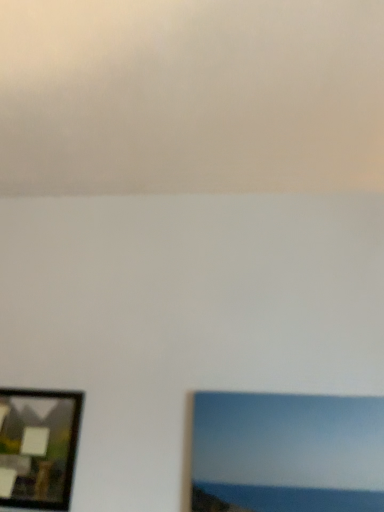
In order to face matte blue picture frame at lower right, the 1th picture frame viewed from the right, should I rotate leftwards or rightwards?

Turn right by 12.004 degrees to look at matte blue picture frame at lower right, the 1th picture frame viewed from the right.

This screenshot has height=512, width=384. Identify the location of matte blue picture frame at lower right, positioned as the second picture frame in left-to-right order. (287, 453).

What is the approximate height of matte blue picture frame at lower right, the 1th picture frame viewed from the right?

matte blue picture frame at lower right, the 1th picture frame viewed from the right, is 33.88 centimeters tall.

What do you see at coordinates (287, 453) in the screenshot?
I see `matte blue picture frame at lower right, positioned as the second picture frame in left-to-right order` at bounding box center [287, 453].

What do you see at coordinates (38, 447) in the screenshot? The height and width of the screenshot is (512, 384). I see `matte black picture frame at lower left, which is counted as the 1th picture frame, starting from the left` at bounding box center [38, 447].

The width and height of the screenshot is (384, 512). In order to click on matte black picture frame at lower left, which is counted as the 1th picture frame, starting from the left in this screenshot , I will do `click(38, 447)`.

What is the approximate height of matte black picture frame at lower left, which is counted as the 1th picture frame, starting from the left?

34.62 centimeters.

Find the location of a particular element. The height and width of the screenshot is (512, 384). matte blue picture frame at lower right, positioned as the second picture frame in left-to-right order is located at coordinates (287, 453).

Consider the image. Considering the relative positions of matte black picture frame at lower left, positioned as the 2th picture frame in right-to-left order, and matte blue picture frame at lower right, positioned as the second picture frame in left-to-right order, in the image provided, is matte black picture frame at lower left, positioned as the 2th picture frame in right-to-left order, to the right of matte blue picture frame at lower right, positioned as the second picture frame in left-to-right order, from the viewer's perspective?

In fact, matte black picture frame at lower left, positioned as the 2th picture frame in right-to-left order, is to the left of matte blue picture frame at lower right, positioned as the second picture frame in left-to-right order.

Considering the relative positions of matte black picture frame at lower left, positioned as the 2th picture frame in right-to-left order, and matte blue picture frame at lower right, positioned as the second picture frame in left-to-right order, in the image provided, is matte black picture frame at lower left, positioned as the 2th picture frame in right-to-left order, in front of matte blue picture frame at lower right, positioned as the second picture frame in left-to-right order,?

No, matte black picture frame at lower left, positioned as the 2th picture frame in right-to-left order, is behind matte blue picture frame at lower right, positioned as the second picture frame in left-to-right order.

Is point (82, 405) positioned after point (370, 426)?

Yes, it is behind point (370, 426).

From the image's perspective, is matte black picture frame at lower left, which is counted as the 1th picture frame, starting from the left, beneath matte blue picture frame at lower right, the 1th picture frame viewed from the right?

Yes, from the image's perspective, matte black picture frame at lower left, which is counted as the 1th picture frame, starting from the left, is below matte blue picture frame at lower right, the 1th picture frame viewed from the right.

In the scene shown: From a real-world perspective, which is physically below, matte black picture frame at lower left, positioned as the 2th picture frame in right-to-left order, or matte blue picture frame at lower right, positioned as the second picture frame in left-to-right order?

In real-world perspective, matte black picture frame at lower left, positioned as the 2th picture frame in right-to-left order, is lower.

Is matte black picture frame at lower left, positioned as the 2th picture frame in right-to-left order, wider or thinner than matte blue picture frame at lower right, positioned as the second picture frame in left-to-right order?

Considering their sizes, matte black picture frame at lower left, positioned as the 2th picture frame in right-to-left order, looks slimmer than matte blue picture frame at lower right, positioned as the second picture frame in left-to-right order.

In terms of height, does matte black picture frame at lower left, positioned as the 2th picture frame in right-to-left order, look taller or shorter compared to matte blue picture frame at lower right, the 1th picture frame viewed from the right?

In the image, matte black picture frame at lower left, positioned as the 2th picture frame in right-to-left order, appears to be taller than matte blue picture frame at lower right, the 1th picture frame viewed from the right.

Considering the relative sizes of matte black picture frame at lower left, which is counted as the 1th picture frame, starting from the left, and matte blue picture frame at lower right, the 1th picture frame viewed from the right, in the image provided, is matte black picture frame at lower left, which is counted as the 1th picture frame, starting from the left, smaller than matte blue picture frame at lower right, the 1th picture frame viewed from the right,?

Indeed, matte black picture frame at lower left, which is counted as the 1th picture frame, starting from the left, has a smaller size compared to matte blue picture frame at lower right, the 1th picture frame viewed from the right.

Is matte black picture frame at lower left, positioned as the 2th picture frame in right-to-left order, inside the boundaries of matte blue picture frame at lower right, positioned as the second picture frame in left-to-right order, or outside?

matte black picture frame at lower left, positioned as the 2th picture frame in right-to-left order, lies outside matte blue picture frame at lower right, positioned as the second picture frame in left-to-right order.

Would you say matte black picture frame at lower left, positioned as the 2th picture frame in right-to-left order, is a long distance from matte blue picture frame at lower right, positioned as the second picture frame in left-to-right order?

No, matte black picture frame at lower left, positioned as the 2th picture frame in right-to-left order, is in close proximity to matte blue picture frame at lower right, positioned as the second picture frame in left-to-right order.

Does matte black picture frame at lower left, positioned as the 2th picture frame in right-to-left order, turn towards matte blue picture frame at lower right, the 1th picture frame viewed from the right?

No, matte black picture frame at lower left, positioned as the 2th picture frame in right-to-left order, is not turned towards matte blue picture frame at lower right, the 1th picture frame viewed from the right.

Could you measure the distance between matte black picture frame at lower left, positioned as the 2th picture frame in right-to-left order, and matte blue picture frame at lower right, the 1th picture frame viewed from the right?

The distance of matte black picture frame at lower left, positioned as the 2th picture frame in right-to-left order, from matte blue picture frame at lower right, the 1th picture frame viewed from the right, is 21.90 inches.

What are the coordinates of `picture frame lying above the matte black picture frame at lower left, positioned as the 2th picture frame in right-to-left order (from the image's perspective)` in the screenshot? It's located at (287, 453).

Can you confirm if matte blue picture frame at lower right, the 1th picture frame viewed from the right, is positioned to the right of matte black picture frame at lower left, which is counted as the 1th picture frame, starting from the left?

Indeed, matte blue picture frame at lower right, the 1th picture frame viewed from the right, is positioned on the right side of matte black picture frame at lower left, which is counted as the 1th picture frame, starting from the left.

Between matte blue picture frame at lower right, positioned as the second picture frame in left-to-right order, and matte black picture frame at lower left, which is counted as the 1th picture frame, starting from the left, which one is positioned in front?

matte blue picture frame at lower right, positioned as the second picture frame in left-to-right order, is in front.

Is point (274, 506) in front of point (33, 395)?

That is True.

From the image's perspective, which object appears higher, matte blue picture frame at lower right, the 1th picture frame viewed from the right, or matte black picture frame at lower left, which is counted as the 1th picture frame, starting from the left?

matte blue picture frame at lower right, the 1th picture frame viewed from the right, is shown above in the image.

From a real-world perspective, is matte blue picture frame at lower right, the 1th picture frame viewed from the right, positioned above or below matte black picture frame at lower left, positioned as the 2th picture frame in right-to-left order?

matte blue picture frame at lower right, the 1th picture frame viewed from the right, is situated higher than matte black picture frame at lower left, positioned as the 2th picture frame in right-to-left order, in the real world.

From the picture: Can you confirm if matte blue picture frame at lower right, positioned as the second picture frame in left-to-right order, is thinner than matte black picture frame at lower left, positioned as the 2th picture frame in right-to-left order?

No.

Considering the relative sizes of matte blue picture frame at lower right, positioned as the second picture frame in left-to-right order, and matte black picture frame at lower left, which is counted as the 1th picture frame, starting from the left, in the image provided, is matte blue picture frame at lower right, positioned as the second picture frame in left-to-right order, taller than matte black picture frame at lower left, which is counted as the 1th picture frame, starting from the left,?

In fact, matte blue picture frame at lower right, positioned as the second picture frame in left-to-right order, may be shorter than matte black picture frame at lower left, which is counted as the 1th picture frame, starting from the left.

Does matte blue picture frame at lower right, the 1th picture frame viewed from the right, have a smaller size compared to matte black picture frame at lower left, which is counted as the 1th picture frame, starting from the left?

No.

Would you say matte blue picture frame at lower right, positioned as the second picture frame in left-to-right order, is outside matte black picture frame at lower left, which is counted as the 1th picture frame, starting from the left?

Indeed, matte blue picture frame at lower right, positioned as the second picture frame in left-to-right order, is completely outside matte black picture frame at lower left, which is counted as the 1th picture frame, starting from the left.

Is matte blue picture frame at lower right, the 1th picture frame viewed from the right, not near matte black picture frame at lower left, which is counted as the 1th picture frame, starting from the left?

matte blue picture frame at lower right, the 1th picture frame viewed from the right, is near matte black picture frame at lower left, which is counted as the 1th picture frame, starting from the left, not far away.

Is matte blue picture frame at lower right, the 1th picture frame viewed from the right, oriented away from matte black picture frame at lower left, positioned as the 2th picture frame in right-to-left order?

No, matte blue picture frame at lower right, the 1th picture frame viewed from the right, is not facing away from matte black picture frame at lower left, positioned as the 2th picture frame in right-to-left order.

What's the angular difference between matte blue picture frame at lower right, the 1th picture frame viewed from the right, and matte black picture frame at lower left, which is counted as the 1th picture frame, starting from the left,'s facing directions?

The facing directions of matte blue picture frame at lower right, the 1th picture frame viewed from the right, and matte black picture frame at lower left, which is counted as the 1th picture frame, starting from the left, are 0.324 degrees apart.

How far apart are matte blue picture frame at lower right, positioned as the second picture frame in left-to-right order, and matte black picture frame at lower left, positioned as the 2th picture frame in right-to-left order?

matte blue picture frame at lower right, positioned as the second picture frame in left-to-right order, is 21.90 inches away from matte black picture frame at lower left, positioned as the 2th picture frame in right-to-left order.

Where is `picture frame that appears on the right of matte black picture frame at lower left, which is counted as the 1th picture frame, starting from the left`? picture frame that appears on the right of matte black picture frame at lower left, which is counted as the 1th picture frame, starting from the left is located at coordinates (287, 453).

Identify the location of picture frame that is on the left side of matte blue picture frame at lower right, positioned as the second picture frame in left-to-right order. Image resolution: width=384 pixels, height=512 pixels. (38, 447).

Identify the location of picture frame lying on the right of matte black picture frame at lower left, which is counted as the 1th picture frame, starting from the left. (287, 453).